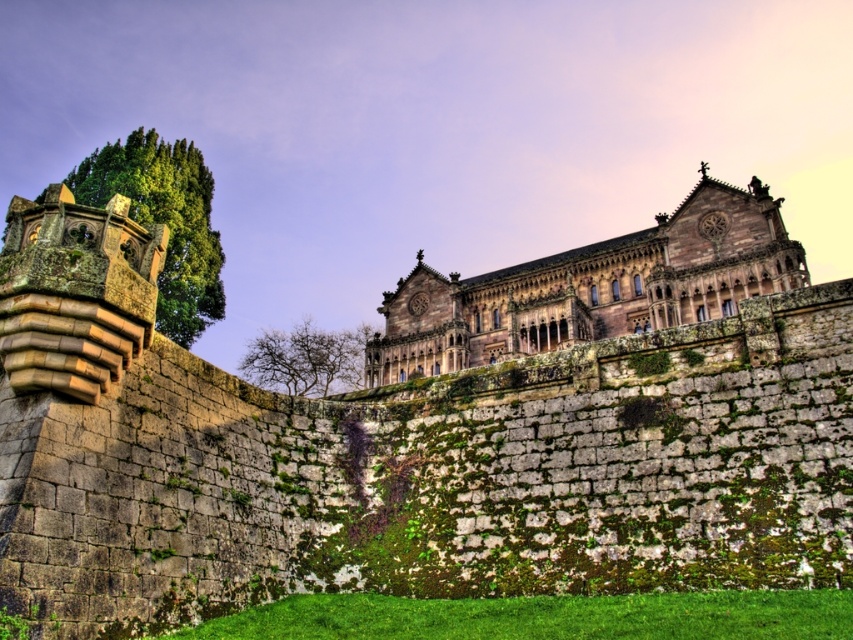
Which of these two, brown stone palace at center or green leafy tree at left, stands taller?

green leafy tree at left is taller.

Does brown stone palace at center appear over green leafy tree at left?

No.

At what (x,y) coordinates should I click in order to perform the action: click on brown stone palace at center. Please return your answer as a coordinate pair (x, y). The width and height of the screenshot is (853, 640). Looking at the image, I should click on (590, 288).

Where is `brown stone palace at center`? brown stone palace at center is located at coordinates click(x=590, y=288).

Can you confirm if brown stone palace at center is shorter than bare branches at center?

Incorrect, brown stone palace at center's height does not fall short of bare branches at center's.

Does brown stone palace at center appear on the right side of bare branches at center?

Correct, you'll find brown stone palace at center to the right of bare branches at center.

Which is behind, point (650, 243) or point (340, 365)?

Point (340, 365)

This screenshot has width=853, height=640. In order to click on brown stone palace at center in this screenshot , I will do `click(590, 288)`.

From the picture: Measure the distance between point (144, 193) and camera.

Point (144, 193) and camera are 227.46 feet apart.

Is green leafy tree at left wider than bare branches at center?

Yes, green leafy tree at left is wider than bare branches at center.

Who is more forward, (154, 148) or (289, 344)?

Positioned in front is point (154, 148).

This screenshot has width=853, height=640. What are the coordinates of `green leafy tree at left` in the screenshot? It's located at click(164, 220).